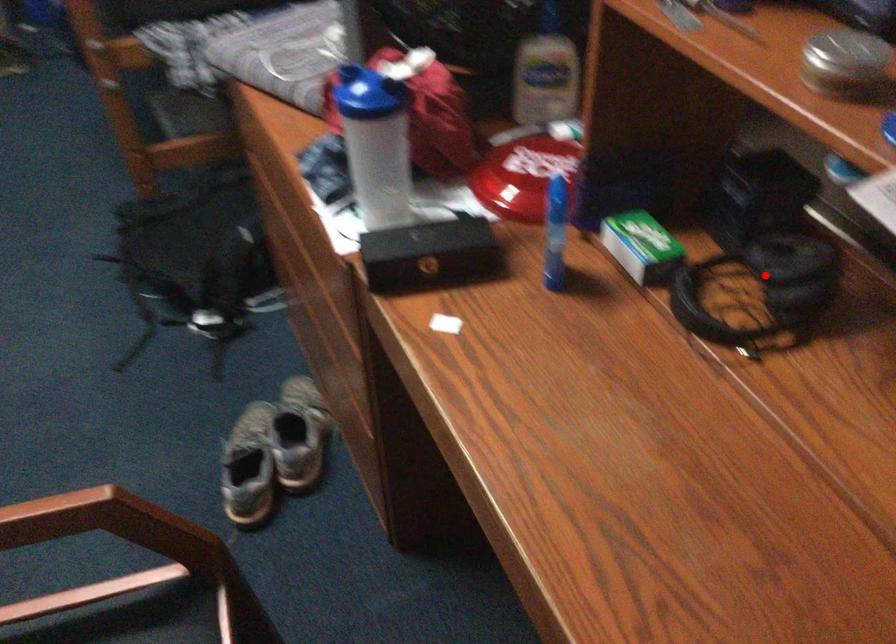
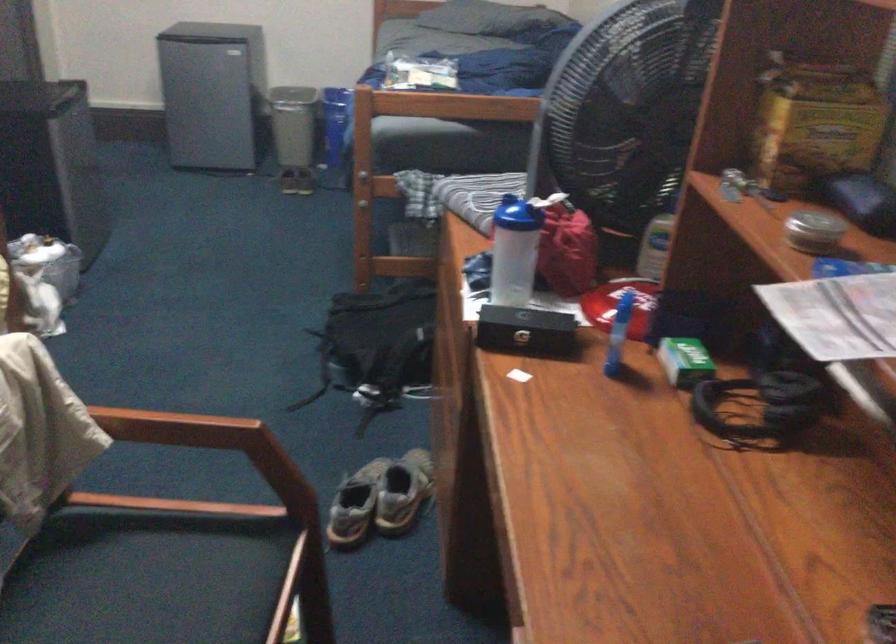
The point at the highlighted location is marked in the first image. Where is the corresponding point in the second image?

(767, 397)